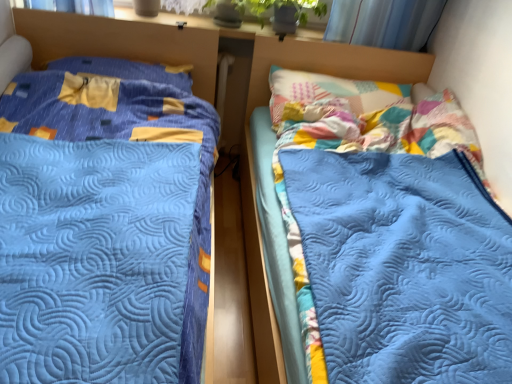
Image resolution: width=512 pixels, height=384 pixels. What are the coordinates of `blue quilted bed at left, placed as the 2th bed when sorted from right to left` in the screenshot? It's located at (101, 229).

In order to face blue quilted bed at left, placed as the 2th bed when sorted from right to left, should I rotate leftwards or rightwards?

A 22.486 degree turn to the left will do.

What do you see at coordinates (127, 70) in the screenshot? I see `yellow fabric pillow at upper left` at bounding box center [127, 70].

Locate an element on the screen. yellow fabric pillow at upper left is located at coordinates 127,70.

Image resolution: width=512 pixels, height=384 pixels. Find the location of `blue quilted bed at center, placed as the first bed when sorted from right to left`. blue quilted bed at center, placed as the first bed when sorted from right to left is located at coordinates coord(259,165).

From the image's perspective, relative to yellow fabric pillow at upper left, is blue quilted bed at left, placed as the 2th bed when sorted from right to left, above or below?

From the image's perspective, blue quilted bed at left, placed as the 2th bed when sorted from right to left, appears below yellow fabric pillow at upper left.

This screenshot has width=512, height=384. Identify the location of pillow that appears above the blue quilted bed at left, placed as the 2th bed when sorted from right to left (from the image's perspective). (127, 70).

In the image, is blue quilted bed at left, placed as the first bed when sorted from left to right, on the left side or the right side of yellow fabric pillow at upper left?

blue quilted bed at left, placed as the first bed when sorted from left to right, is positioned on yellow fabric pillow at upper left's right side.

Is blue quilted bed at left, placed as the 2th bed when sorted from right to left, turned away from yellow fabric pillow at upper left?

Yes, yellow fabric pillow at upper left is at the back of blue quilted bed at left, placed as the 2th bed when sorted from right to left.

Can you confirm if blue quilted bed at center, the 2th bed from the left, is smaller than yellow fabric pillow at upper left?

No, blue quilted bed at center, the 2th bed from the left, is not smaller than yellow fabric pillow at upper left.

Do you think blue quilted bed at center, placed as the first bed when sorted from right to left, is within yellow fabric pillow at upper left, or outside of it?

The correct answer is: outside.

From the image's perspective, which one is positioned higher, blue quilted bed at center, placed as the first bed when sorted from right to left, or yellow fabric pillow at upper left?

From the image's view, yellow fabric pillow at upper left is above.

In the scene shown: Is blue quilted bed at center, the 2th bed from the left, facing towards yellow fabric pillow at upper left?

No, blue quilted bed at center, the 2th bed from the left, is not facing towards yellow fabric pillow at upper left.

Does point (176, 163) come behind point (422, 88)?

No, (176, 163) is closer to viewer.

Which object is closer to the camera taking this photo, blue quilted bed at left, placed as the first bed when sorted from left to right, or blue quilted bed at center, placed as the first bed when sorted from right to left?

blue quilted bed at left, placed as the first bed when sorted from left to right.

Can you confirm if blue quilted bed at left, placed as the 2th bed when sorted from right to left, is smaller than blue quilted bed at center, the 2th bed from the left?

Actually, blue quilted bed at left, placed as the 2th bed when sorted from right to left, might be larger than blue quilted bed at center, the 2th bed from the left.

From the image's perspective, is yellow fabric pillow at upper left on top of blue quilted bed at center, placed as the first bed when sorted from right to left?

Correct, yellow fabric pillow at upper left appears higher than blue quilted bed at center, placed as the first bed when sorted from right to left, in the image.

Is yellow fabric pillow at upper left shorter than blue quilted bed at center, placed as the first bed when sorted from right to left?

Yes.

Is yellow fabric pillow at upper left aimed at blue quilted bed at center, placed as the first bed when sorted from right to left?

No.

Based on their positions, is yellow fabric pillow at upper left located to the left or right of blue quilted bed at center, the 2th bed from the left?

Based on their positions, yellow fabric pillow at upper left is located to the left of blue quilted bed at center, the 2th bed from the left.

Based on the photo, is blue quilted bed at center, placed as the first bed when sorted from right to left, not close to blue quilted bed at left, placed as the 2th bed when sorted from right to left?

Yes, blue quilted bed at center, placed as the first bed when sorted from right to left, is far from blue quilted bed at left, placed as the 2th bed when sorted from right to left.

Can blue quilted bed at left, placed as the 2th bed when sorted from right to left, be found inside blue quilted bed at center, the 2th bed from the left?

That's incorrect, blue quilted bed at left, placed as the 2th bed when sorted from right to left, is not inside blue quilted bed at center, the 2th bed from the left.

Is blue quilted bed at center, the 2th bed from the left, to the right of blue quilted bed at left, placed as the 2th bed when sorted from right to left, from the viewer's perspective?

Yes.

Between blue quilted bed at center, placed as the first bed when sorted from right to left, and blue quilted bed at left, placed as the first bed when sorted from left to right, which one has less height?

With less height is blue quilted bed at center, placed as the first bed when sorted from right to left.

Would you say yellow fabric pillow at upper left is outside blue quilted bed at left, placed as the 2th bed when sorted from right to left?

That's incorrect, yellow fabric pillow at upper left is not completely outside blue quilted bed at left, placed as the 2th bed when sorted from right to left.

From a real-world perspective, which is physically above, yellow fabric pillow at upper left or blue quilted bed at left, placed as the 2th bed when sorted from right to left?

yellow fabric pillow at upper left, from a real-world perspective.

Based on the photo, who is taller, yellow fabric pillow at upper left or blue quilted bed at left, placed as the first bed when sorted from left to right?

Standing taller between the two is blue quilted bed at left, placed as the first bed when sorted from left to right.

What's the angular difference between yellow fabric pillow at upper left and blue quilted bed at left, placed as the 2th bed when sorted from right to left,'s facing directions?

The facing directions of yellow fabric pillow at upper left and blue quilted bed at left, placed as the 2th bed when sorted from right to left, are 3.06e-05 degrees apart.

From the image's perspective, count 1st beds downward from the yellow fabric pillow at upper left and point to it. Please provide its 2D coordinates.

[(101, 229)]

Identify the location of pillow that appears above the blue quilted bed at center, the 2th bed from the left (from a real-world perspective). This screenshot has width=512, height=384. (127, 70).

Looking at the image, which one is located further to yellow fabric pillow at upper left, blue quilted bed at left, placed as the 2th bed when sorted from right to left, or blue quilted bed at center, the 2th bed from the left?

blue quilted bed at center, the 2th bed from the left, is positioned further to the anchor yellow fabric pillow at upper left.

Based on their spatial positions, is yellow fabric pillow at upper left or blue quilted bed at left, placed as the first bed when sorted from left to right, closer to blue quilted bed at center, the 2th bed from the left?

Among the two, yellow fabric pillow at upper left is located nearer to blue quilted bed at center, the 2th bed from the left.

Looking at the image, which one is located further to blue quilted bed at left, placed as the first bed when sorted from left to right, yellow fabric pillow at upper left or blue quilted bed at center, placed as the first bed when sorted from right to left?

blue quilted bed at center, placed as the first bed when sorted from right to left.

Which object lies nearer to the anchor point blue quilted bed at left, placed as the 2th bed when sorted from right to left, blue quilted bed at center, the 2th bed from the left, or yellow fabric pillow at upper left?

yellow fabric pillow at upper left is closer to blue quilted bed at left, placed as the 2th bed when sorted from right to left.

Based on their spatial positions, is blue quilted bed at left, placed as the first bed when sorted from left to right, or yellow fabric pillow at upper left closer to blue quilted bed at center, the 2th bed from the left?

The object closer to blue quilted bed at center, the 2th bed from the left, is yellow fabric pillow at upper left.

From the image, which object appears to be farther from yellow fabric pillow at upper left, blue quilted bed at center, the 2th bed from the left, or blue quilted bed at left, placed as the 2th bed when sorted from right to left?

blue quilted bed at center, the 2th bed from the left, is further to yellow fabric pillow at upper left.

At what (x,y) coordinates should I click in order to perform the action: click on bed between blue quilted bed at left, placed as the first bed when sorted from left to right, and yellow fabric pillow at upper left from front to back. Please return your answer as a coordinate pair (x, y). The width and height of the screenshot is (512, 384). Looking at the image, I should click on (259, 165).